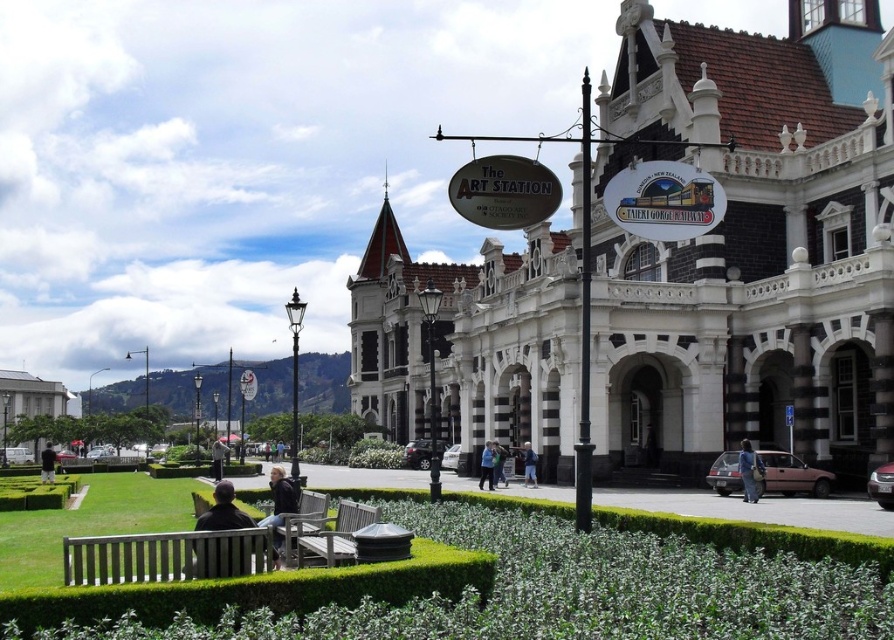
Question: Which of these objects is positioned closest to the wooden bench at center?

Choices:
 (A) matte pink car at lower right
 (B) dark brown leather jacket at lower left

Answer: (B)

Question: In this image, where is wooden slats bench at lower left located relative to white stone building at left?

Choices:
 (A) below
 (B) above

Answer: (B)

Question: Which object appears closest to the camera in this image?

Choices:
 (A) denim jacket at lower right
 (B) blue denim jacket at center
 (C) dark gray jacket at center
 (D) white stone building at left

Answer: (A)

Question: Which of the following is the closest to the observer?

Choices:
 (A) dark brown leather jacket at lower left
 (B) white stone building at center
 (C) light blue denim jacket at center
 (D) white stone building at left

Answer: (A)

Question: Does wooden bench at center have a smaller size compared to blue denim jacket at center?

Choices:
 (A) yes
 (B) no

Answer: (B)

Question: Observing the image, what is the correct spatial positioning of matte pink car at lower right in reference to light blue denim jacket at center?

Choices:
 (A) above
 (B) below

Answer: (A)